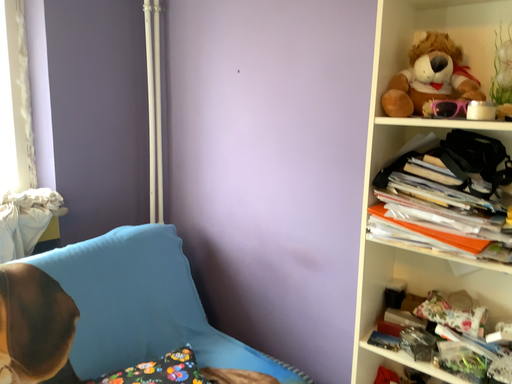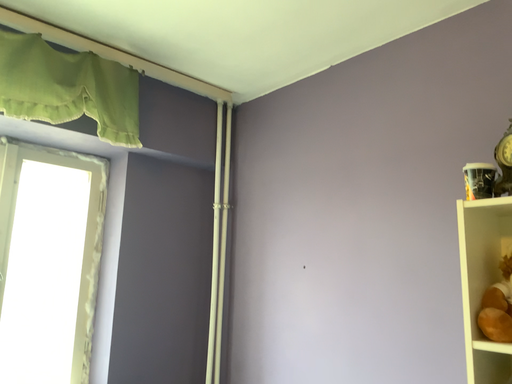
Question: Which way did the camera rotate in the video?

Choices:
 (A) rotated right
 (B) rotated left

Answer: (B)